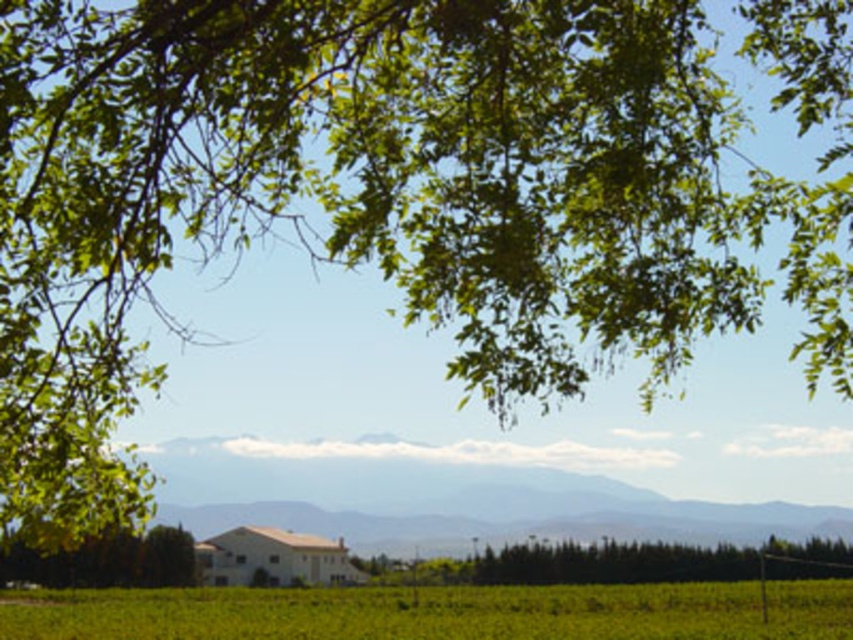
Can you confirm if green leafy tree at center is wider than green leafy tree at lower left?

Correct, the width of green leafy tree at center exceeds that of green leafy tree at lower left.

Who is positioned more to the right, green leafy tree at center or green leafy tree at lower left?

green leafy tree at center is more to the right.

Measure the distance between point (801, 552) and camera.

A distance of 18.61 meters exists between point (801, 552) and camera.

This screenshot has height=640, width=853. I want to click on green leafy tree at center, so point(645,563).

Between green grass at lower center and green leafy tree at lower left, which one has less height?

With less height is green leafy tree at lower left.

In order to click on green grass at lower center in this screenshot , I will do `click(437, 612)`.

Which is behind, point (184, 636) or point (97, 560)?

Point (97, 560)

Where is `green grass at lower center`? green grass at lower center is located at coordinates (437, 612).

Image resolution: width=853 pixels, height=640 pixels. Describe the element at coordinates (437, 612) in the screenshot. I see `green grass at lower center` at that location.

Does green grass at lower center lie in front of green leafy tree at center?

Yes, it is in front of green leafy tree at center.

Between point (750, 588) and point (672, 554), which one is positioned behind?

The point (750, 588) is behind.

The height and width of the screenshot is (640, 853). Identify the location of green grass at lower center. (437, 612).